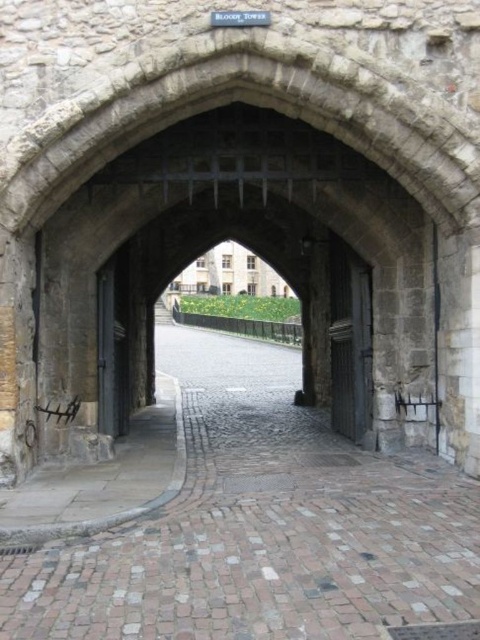
Question: Which is nearer to the dark gray metal door at left?

Choices:
 (A) dark gray stone door at center
 (B) cobblestone path at center

Answer: (B)

Question: Does cobblestone path at center come in front of dark gray stone door at center?

Choices:
 (A) yes
 (B) no

Answer: (A)

Question: Can you confirm if dark gray stone door at center is positioned to the left of dark gray metal door at left?

Choices:
 (A) yes
 (B) no

Answer: (B)

Question: Among these points, which one is nearest to the camera?

Choices:
 (A) (360, 413)
 (B) (21, 593)
 (C) (108, 358)

Answer: (B)

Question: Observing the image, what is the correct spatial positioning of cobblestone path at center in reference to dark gray stone door at center?

Choices:
 (A) right
 (B) left

Answer: (B)

Question: Which point is closer to the camera?

Choices:
 (A) cobblestone path at center
 (B) dark gray stone door at center
 (C) dark gray metal door at left

Answer: (A)